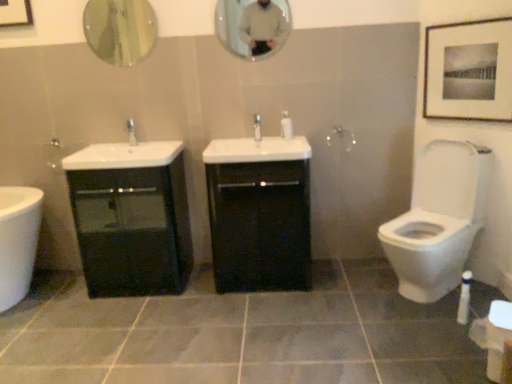
Question: From the image's perspective, relative to gray matte tile at center, is black glossy cabinet at center, which is counted as the 2th bathroom cabinet, starting from the left, above or below?

Choices:
 (A) below
 (B) above

Answer: (B)

Question: Is black glossy cabinet at center, the first bathroom cabinet when ordered from right to left, situated inside gray matte tile at center or outside?

Choices:
 (A) outside
 (B) inside

Answer: (A)

Question: Considering the real-world distances, which object is closest to the metallic circular mirror at upper left, arranged as the second mirror when viewed from the right?

Choices:
 (A) white glossy tap at center, the first tap in the right-to-left sequence
 (B) black glossy cabinet at center, which is counted as the 2th bathroom cabinet, starting from the left
 (C) white glossy soap dispenser at center
 (D) matte black picture frame at upper right
 (E) white glossy toilet at right

Answer: (B)

Question: Based on their relative distances, which object is farther from the white glossy soap dispenser at center?

Choices:
 (A) white glossy toilet at right
 (B) gray matte tile at center
 (C) matte glass mirror at upper center, which appears as the 2th mirror when viewed from the left
 (D) matte silver faucet at center, which ranks as the 2th tap in right-to-left order
 (E) matte black picture frame at upper right

Answer: (B)